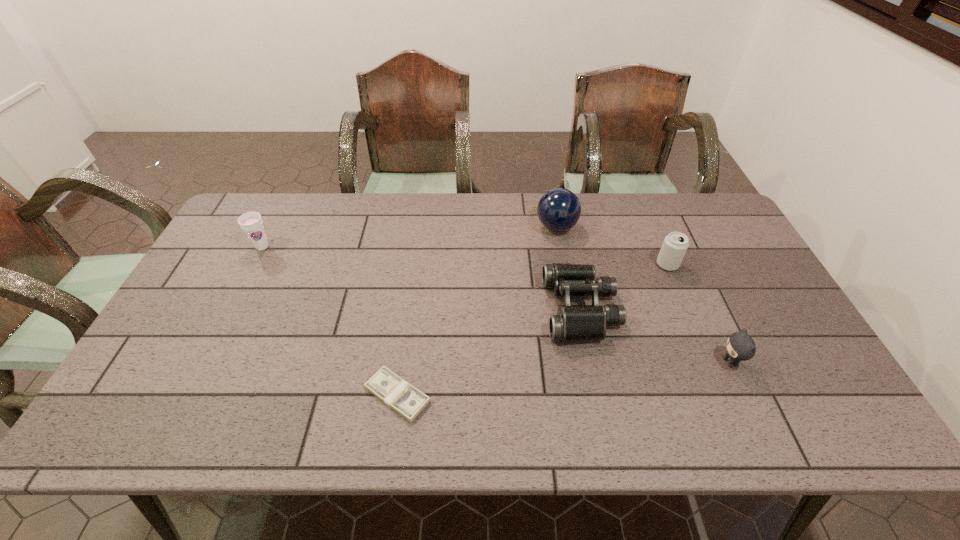
Locate an element on the screen. the tallest object is located at coordinates (559, 209).

Where is `the leftmost object`? the leftmost object is located at coordinates (251, 222).

Image resolution: width=960 pixels, height=540 pixels. What are the coordinates of `the third farthest object` in the screenshot? It's located at (675, 245).

The height and width of the screenshot is (540, 960). Identify the location of binoculars. (572, 323).

Identify the location of kitten. (740, 346).

This screenshot has width=960, height=540. Find the location of `the shortest object`. the shortest object is located at coordinates (395, 392).

Image resolution: width=960 pixels, height=540 pixels. What are the coordinates of `dollar` in the screenshot? It's located at (395, 392).

At what (x,y) coordinates should I click in order to perform the action: click on blank space located 0.310m on the surface of the tallest object near the finger holes. Please return your answer as a coordinate pair (x, y). The image size is (960, 540). Looking at the image, I should click on (442, 227).

At what (x,y) coordinates should I click in order to perform the action: click on vacant region located on the surface of the tallest object near the finger holes. Please return your answer as a coordinate pair (x, y). This screenshot has height=540, width=960. Looking at the image, I should click on (515, 227).

The width and height of the screenshot is (960, 540). I want to click on vacant space located on the surface of the tallest object near the finger holes, so click(x=487, y=227).